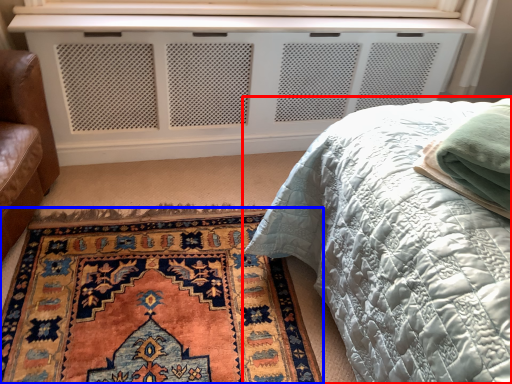
Question: Which object appears closest to the camera in this image, bed (highlighted by a red box) or mat (highlighted by a blue box)?

Choices:
 (A) bed
 (B) mat

Answer: (A)